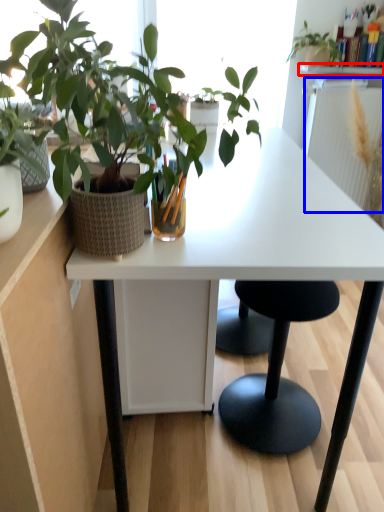
Question: Among these objects, which one is nearest to the camera, window sill (highlighted by a red box) or radiator (highlighted by a blue box)?

Choices:
 (A) window sill
 (B) radiator

Answer: (B)